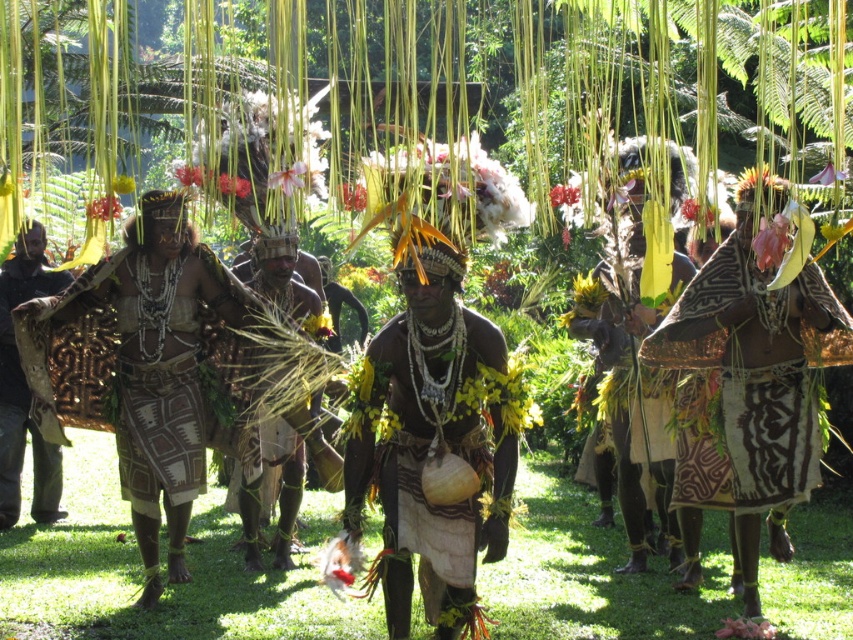
You are a photographer at the event and want to capture both the matte black headdress at center and the brown woven cloth at center in a single frame. Which object should you focus on first to ensure both are in the frame?

The matte black headdress at center has a smaller size compared to brown woven cloth at center, so you should focus on the matte black headdress at center first to ensure both are in the frame.

You are a photographer taking pictures of the cultural scene. You notice two points of interest marked as point 1 at coordinates point (497, 408) and point 2 at coordinates point (827, 301). Which point should you focus on first to capture the most prominent part of the scene?

Point (497, 408) is closer to the viewer than point (827, 301), so focusing on point (497, 408) first will capture the most prominent part of the scene.